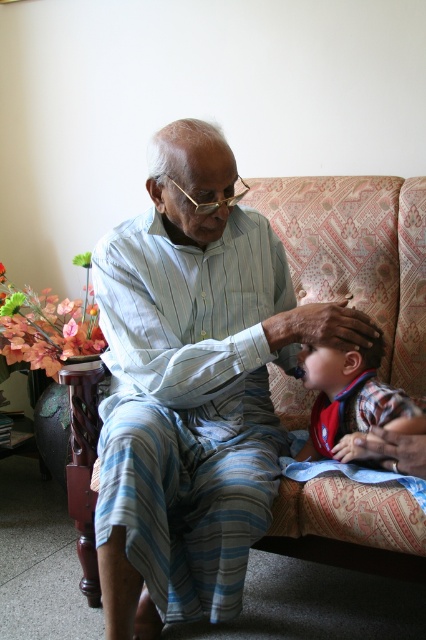
Does light blue striped pajamas at center have a larger size compared to plaid fabric shirt at lower right?

Correct, light blue striped pajamas at center is larger in size than plaid fabric shirt at lower right.

In the scene shown: Between light blue striped pajamas at center and plaid fabric shirt at lower right, which one appears on the left side from the viewer's perspective?

light blue striped pajamas at center is more to the left.

This screenshot has width=426, height=640. I want to click on light blue striped pajamas at center, so click(x=192, y=387).